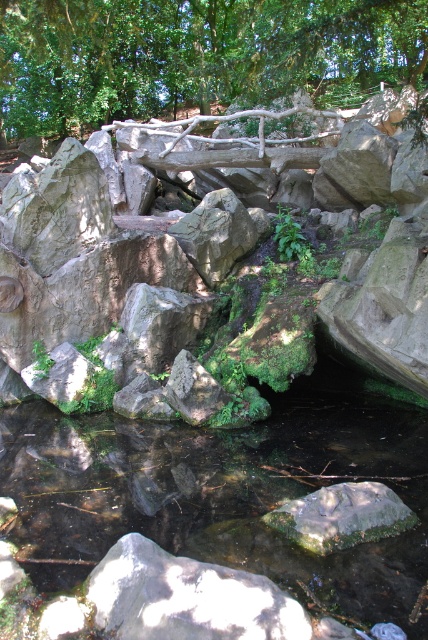
Question: Can you confirm if green leafy tree at upper center is bigger than green mossy rock at center?

Choices:
 (A) yes
 (B) no

Answer: (A)

Question: Which point is farther from the camera taking this photo?

Choices:
 (A) (146, 225)
 (B) (270, 504)
 (C) (85, 81)
 (D) (318, 532)

Answer: (C)

Question: Which object appears farthest from the camera in this image?

Choices:
 (A) clear water at center
 (B) rough gray rock at center
 (C) green mossy rock at center
 (D) green leafy tree at upper center

Answer: (D)

Question: Does rough gray rock at center appear on the left side of green mossy rock at center?

Choices:
 (A) yes
 (B) no

Answer: (A)

Question: Is green leafy tree at upper center positioned before green mossy rock at center?

Choices:
 (A) yes
 (B) no

Answer: (B)

Question: Which of the following is the farthest from the observer?

Choices:
 (A) (183, 474)
 (B) (226, 81)

Answer: (B)